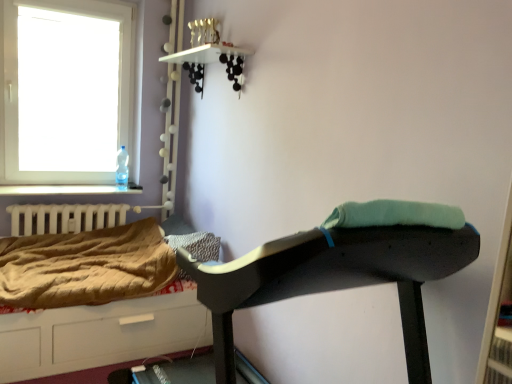
Question: From a real-world perspective, is transparent glass window at upper left physically located above or below brown quilted hospital bed at lower left?

Choices:
 (A) below
 (B) above

Answer: (B)

Question: From the image's perspective, is transparent glass window at upper left above or below brown quilted hospital bed at lower left?

Choices:
 (A) below
 (B) above

Answer: (B)

Question: Which of these objects is positioned closest to the transparent plastic bottle at window left?

Choices:
 (A) brown quilted hospital bed at lower left
 (B) white matte radiator at left
 (C) matte black ironing board at center
 (D) brown quilted blanket at lower left
 (E) transparent glass window at upper left

Answer: (B)

Question: Which of these objects is positioned farthest from the matte black ironing board at center?

Choices:
 (A) brown quilted hospital bed at lower left
 (B) white matte radiator at left
 (C) brown quilted blanket at lower left
 (D) transparent plastic bottle at window left
 (E) transparent glass window at upper left

Answer: (E)